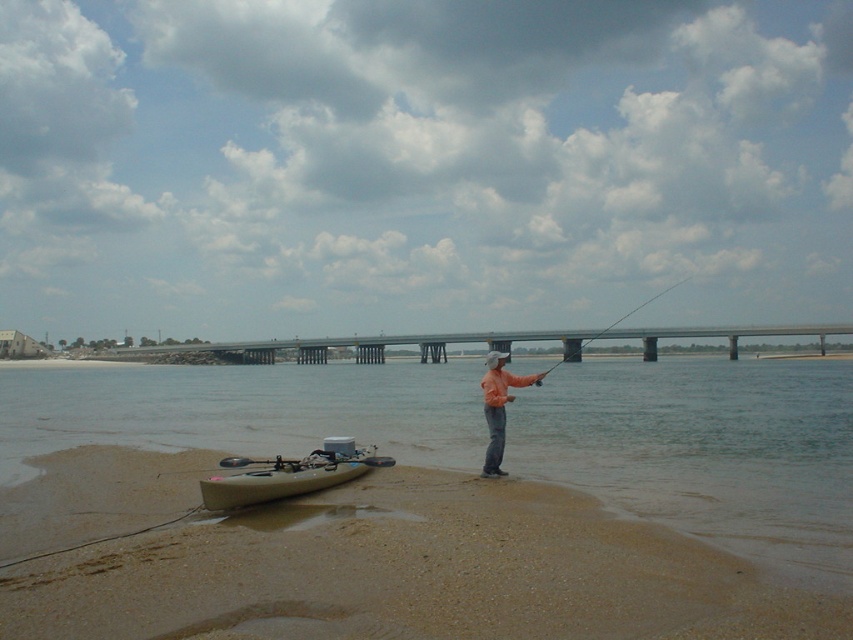
Can you confirm if brown matte water at center is taller than smooth fiberglass rod at center?

In fact, brown matte water at center may be shorter than smooth fiberglass rod at center.

Consider the image. Does brown matte water at center have a greater width compared to smooth fiberglass rod at center?

Correct, the width of brown matte water at center exceeds that of smooth fiberglass rod at center.

Where is `brown matte water at center`? Image resolution: width=853 pixels, height=640 pixels. brown matte water at center is located at coordinates (703, 449).

In the scene shown: Does brown matte water at center have a smaller size compared to orange matte jacket at center?

Actually, brown matte water at center might be larger than orange matte jacket at center.

Is brown matte water at center positioned in front of orange matte jacket at center?

Yes, brown matte water at center is in front of orange matte jacket at center.

Find the location of a particular element. brown matte water at center is located at coordinates (703, 449).

Does beige plastic kayak at lower left have a greater width compared to smooth fiberglass rod at center?

No.

Locate an element on the screen. beige plastic kayak at lower left is located at coordinates (366, 563).